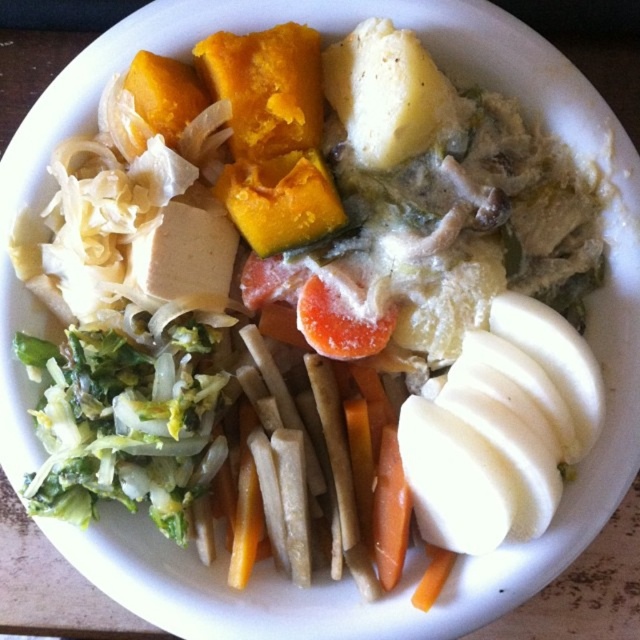
Is green leafymaterial/texturevegetable at lower left to the right of yellow matte potato at upper center from the viewer's perspective?

Incorrect, green leafymaterial/texturevegetable at lower left is not on the right side of yellow matte potato at upper center.

Is green leafymaterial/texturevegetable at lower left to the left of yellow matte potato at upper center from the viewer's perspective?

Indeed, green leafymaterial/texturevegetable at lower left is positioned on the left side of yellow matte potato at upper center.

This screenshot has height=640, width=640. In order to click on green leafymaterial/texturevegetable at lower left in this screenshot , I will do `click(124, 422)`.

Which is below, green leafymaterial/texturevegetable at lower left or orange smooth carrot at center?

Positioned lower is orange smooth carrot at center.

Does point (132, 497) come farther from viewer compared to point (394, 499)?

No, it is not.

Is point (120, 483) positioned before point (380, 477)?

Yes, point (120, 483) is in front of point (380, 477).

The width and height of the screenshot is (640, 640). I want to click on green leafymaterial/texturevegetable at lower left, so click(x=124, y=422).

Is yellow matte potato at upper center taller than orange smooth carrot at center?

Incorrect, yellow matte potato at upper center's height is not larger of orange smooth carrot at center's.

Does yellow matte potato at upper center have a greater width compared to orange smooth carrot at center?

Yes.

Which is in front, point (362, 122) or point (388, 516)?

Point (362, 122) is in front.

Locate an element on the screen. This screenshot has height=640, width=640. yellow matte potato at upper center is located at coordinates (387, 93).